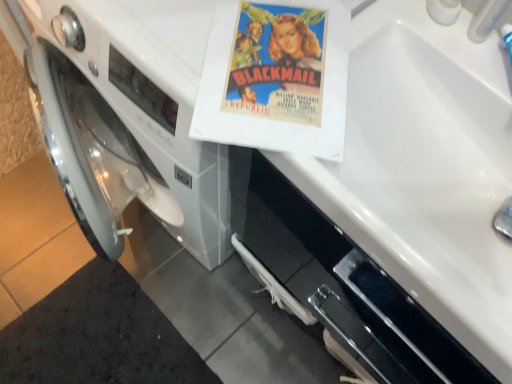
Question: Is white plastic faucet at upper right not near matte paper poster at center?

Choices:
 (A) no
 (B) yes

Answer: (A)

Question: Can you confirm if white plastic faucet at upper right is positioned to the left of matte paper poster at center?

Choices:
 (A) yes
 (B) no

Answer: (B)

Question: Does white plastic faucet at upper right lie in front of matte paper poster at center?

Choices:
 (A) no
 (B) yes

Answer: (B)

Question: Is white plastic faucet at upper right smaller than matte paper poster at center?

Choices:
 (A) yes
 (B) no

Answer: (A)

Question: From a real-world perspective, is white plastic faucet at upper right located beneath matte paper poster at center?

Choices:
 (A) yes
 (B) no

Answer: (B)

Question: Considering the relative positions of white plastic faucet at upper right and white glossy sink at upper right in the image provided, is white plastic faucet at upper right to the left or to the right of white glossy sink at upper right?

Choices:
 (A) left
 (B) right

Answer: (B)

Question: Is white plastic faucet at upper right taller or shorter than white glossy sink at upper right?

Choices:
 (A) tall
 (B) short

Answer: (A)

Question: In the image, is white plastic faucet at upper right positioned in front of or behind white glossy sink at upper right?

Choices:
 (A) behind
 (B) front

Answer: (A)

Question: Considering the positions of point (494, 8) and point (439, 352), is point (494, 8) closer or farther from the camera than point (439, 352)?

Choices:
 (A) farther
 (B) closer

Answer: (B)

Question: Visually, is white glossy sink at upper right positioned to the left or to the right of matte paper poster at center?

Choices:
 (A) right
 (B) left

Answer: (A)

Question: Is white glossy sink at upper right in front of or behind matte paper poster at center in the image?

Choices:
 (A) front
 (B) behind

Answer: (A)

Question: Would you say white glossy sink at upper right is inside or outside matte paper poster at center?

Choices:
 (A) inside
 (B) outside

Answer: (B)

Question: In terms of height, does white glossy sink at upper right look taller or shorter compared to matte paper poster at center?

Choices:
 (A) tall
 (B) short

Answer: (A)

Question: From a real-world perspective, is white glossy sink at upper right positioned above or below white plastic faucet at upper right?

Choices:
 (A) above
 (B) below

Answer: (B)

Question: Is white glossy sink at upper right bigger or smaller than white plastic faucet at upper right?

Choices:
 (A) small
 (B) big

Answer: (B)